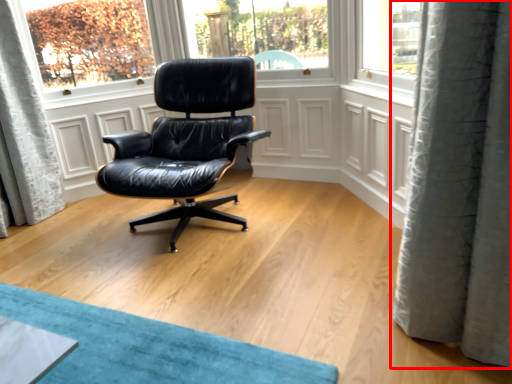
Question: From the image, what is the correct spatial relationship of curtain (annotated by the red box) in relation to chair?

Choices:
 (A) left
 (B) right

Answer: (B)